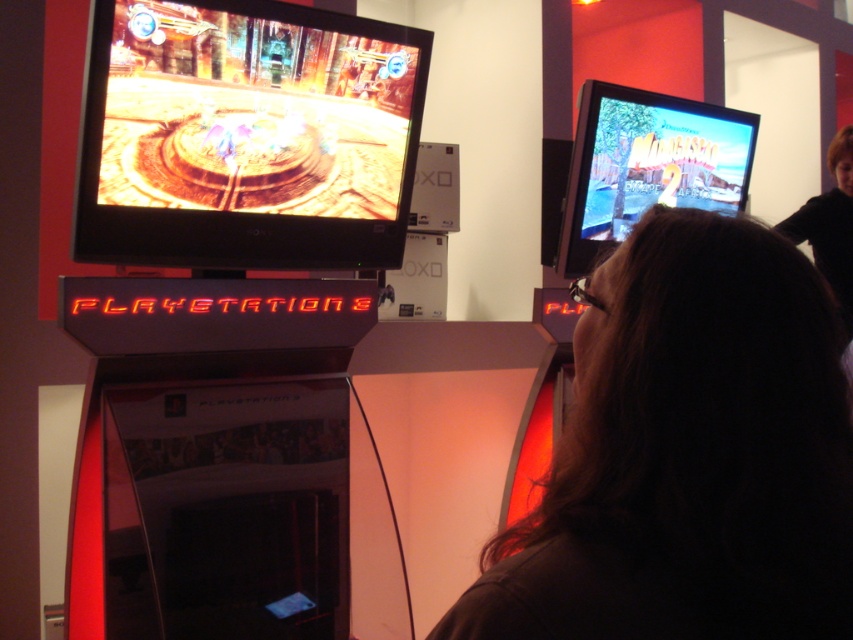
What are the coordinates of the dark brown hair at center in the image?

The dark brown hair at center is located at coordinates point (688,452).

Consider the image. You are a photographer setting up a shoot in this gaming area. You need to position a light source to the left of both the dark brown hair at center and the shiny metallic tv at upper left. Is this possible given their current positions?

The dark brown hair at center is to the right of the shiny metallic tv at upper left, so positioning a light source to the left of both would require placing it to the left of the shiny metallic tv at upper left, which is already the leftmost object. This is possible as long as there is space to the left of the shiny metallic tv at upper left.

You are a photographer trying to capture a clear shot of the dark brown hair at center and the shiny metallic tv at upper left. Considering their sizes, which object should you focus on first to ensure both are in frame without zooming?

The dark brown hair at center is smaller than the shiny metallic tv at upper left, so you should focus on the shiny metallic tv at upper left first to ensure it fits in the frame before adjusting for the smaller dark brown hair at center.